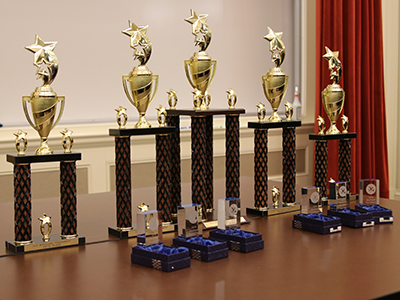
The width and height of the screenshot is (400, 300). I want to click on whiteboard, so click(x=108, y=63).